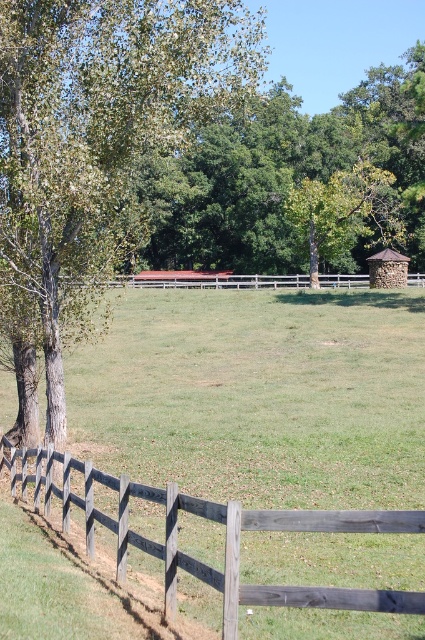
Question: Can you confirm if green leafy tree at left is positioned to the right of wooden fence at center?

Choices:
 (A) no
 (B) yes

Answer: (A)

Question: Can you confirm if green leafy tree at left is positioned above wooden fence at center?

Choices:
 (A) no
 (B) yes

Answer: (B)

Question: Among these objects, which one is farthest from the camera?

Choices:
 (A) green leafy tree at left
 (B) wooden fence at center

Answer: (A)

Question: Considering the relative positions of green leafy tree at left and wooden fence at center in the image provided, where is green leafy tree at left located with respect to wooden fence at center?

Choices:
 (A) right
 (B) left

Answer: (B)